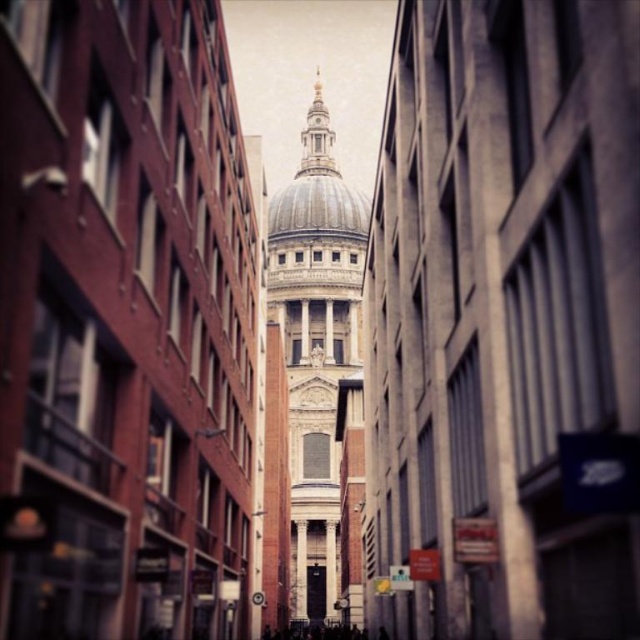
Does point (328, 136) come farther from viewer compared to point (316, 184)?

Yes, point (328, 136) is behind point (316, 184).

In the scene shown: Does white marble dome at center appear under smooth stone dome at center?

No.

Where is `white marble dome at center`? Image resolution: width=640 pixels, height=640 pixels. white marble dome at center is located at coordinates (317, 188).

Who is shorter, white marble tower at center or smooth stone dome at center?

With less height is smooth stone dome at center.

What are the coordinates of `white marble tower at center` in the screenshot? It's located at (320, 369).

Who is more forward, (365, 240) or (330, 180)?

Point (365, 240) is in front.

This screenshot has height=640, width=640. I want to click on white marble tower at center, so click(x=320, y=369).

Describe the element at coordinates (320, 369) in the screenshot. I see `white marble tower at center` at that location.

This screenshot has height=640, width=640. What are the coordinates of `white marble tower at center` in the screenshot? It's located at (320, 369).